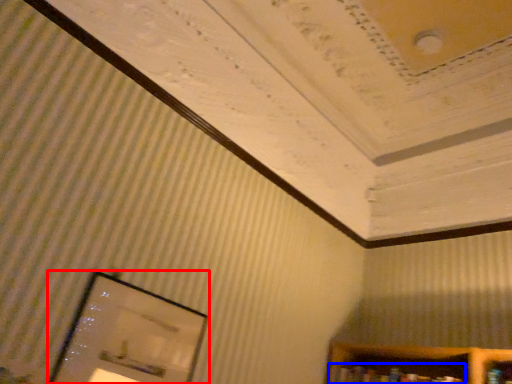
Question: Which object appears closest to the camera in this image, picture frame (highlighted by a red box) or book (highlighted by a blue box)?

Choices:
 (A) picture frame
 (B) book

Answer: (A)